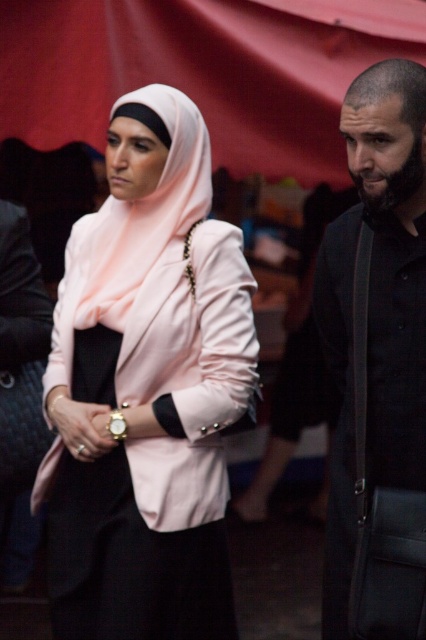
From the picture: You are a photographer setting up for a portrait session. You have a camera with a focal length of 50mm. The subjects are wearing the matte pink blazer at center and the black matte shirt at right. To ensure both subjects are in focus, what is the minimum distance you should set the camera focus point if the depth of field allows sharpness within 25 inches of the focus point?

The matte pink blazer at center is 27.05 inches away from the black matte shirt at right. Since the depth of field covers 25 inches, the focus point needs to be set such that both are within this range. However, the distance between them exceeds the depth of field range. Therefore, it is not possible to have both in focus with the current settings. Adjust the aperture for a larger depth of field or move the subjects closer together.

What are the coordinates of the matte pink blazer at center?

The matte pink blazer at center is located at point (146, 388).

Looking at this image, you are a photographer setting up for a portrait session. You need to ensure that the matte pink blazer at center and the black matte shirt at right are both visible in the frame. Based on their positions, which clothing item is closer to the camera?

The matte pink blazer at center is positioned under the black matte shirt at right, so the black matte shirt at right is closer to the camera because it is above the matte pink blazer at center.